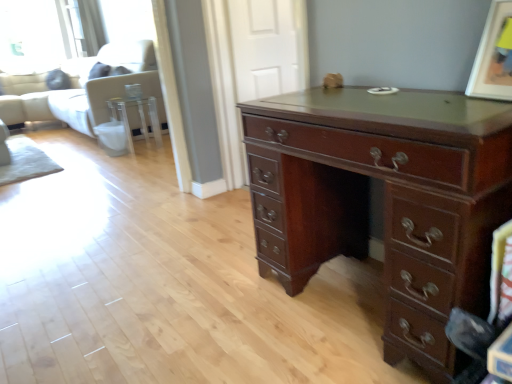
Question: Can you confirm if matte brown picture frame at upper right is bigger than white fabric couch at upper left?

Choices:
 (A) no
 (B) yes

Answer: (A)

Question: Considering the relative positions of matte brown picture frame at upper right and white fabric couch at upper left in the image provided, is matte brown picture frame at upper right to the right of white fabric couch at upper left from the viewer's perspective?

Choices:
 (A) no
 (B) yes

Answer: (B)

Question: From a real-world perspective, is matte brown picture frame at upper right physically below white fabric couch at upper left?

Choices:
 (A) no
 (B) yes

Answer: (A)

Question: Can you confirm if matte brown picture frame at upper right is smaller than white fabric couch at upper left?

Choices:
 (A) yes
 (B) no

Answer: (A)

Question: Is matte brown picture frame at upper right positioned far away from white fabric couch at upper left?

Choices:
 (A) no
 (B) yes

Answer: (B)

Question: Can you confirm if matte brown picture frame at upper right is taller than white fabric couch at upper left?

Choices:
 (A) yes
 (B) no

Answer: (B)

Question: Is clear glass side table at center outside white fabric couch at upper left?

Choices:
 (A) no
 (B) yes

Answer: (B)

Question: Can you confirm if clear glass side table at center is thinner than white fabric couch at upper left?

Choices:
 (A) yes
 (B) no

Answer: (A)

Question: Is clear glass side table at center shorter than white fabric couch at upper left?

Choices:
 (A) no
 (B) yes

Answer: (B)

Question: Is clear glass side table at center turned away from white fabric couch at upper left?

Choices:
 (A) no
 (B) yes

Answer: (A)

Question: From the image's perspective, would you say clear glass side table at center is positioned over white fabric couch at upper left?

Choices:
 (A) yes
 (B) no

Answer: (B)

Question: Is the depth of clear glass side table at center greater than that of white fabric couch at upper left?

Choices:
 (A) yes
 (B) no

Answer: (B)

Question: Does clear glass side table at center appear on the right side of mahogany wood desk at center?

Choices:
 (A) yes
 (B) no

Answer: (B)